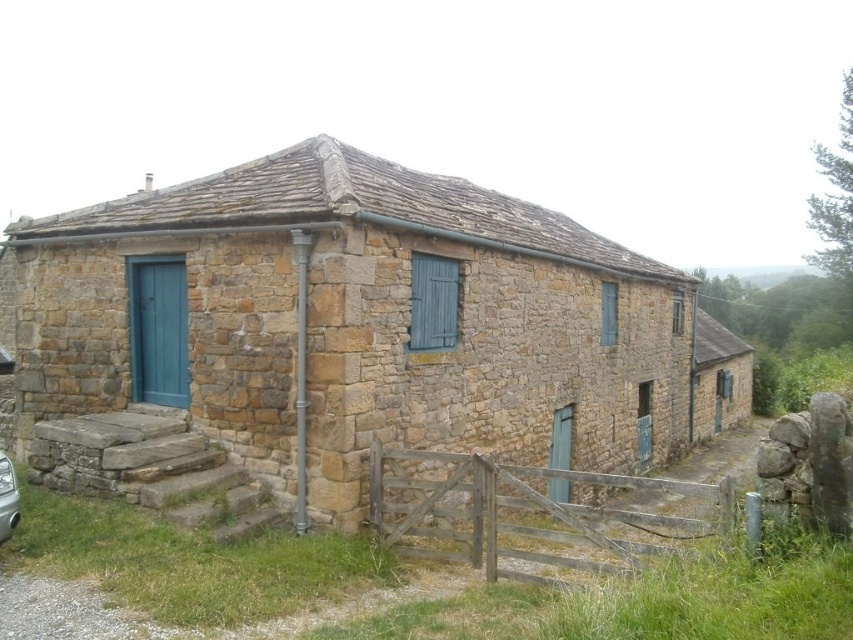
You are standing in front of the rustic stone building and notice two points marked on the ground. One is at coordinate point (331, 340) and the other at point (9, 515). If you want to walk towards the building, which point will you pass first?

You will pass point (9, 515) first because it is in front of point (331, 340), which is located behind it relative to the building.